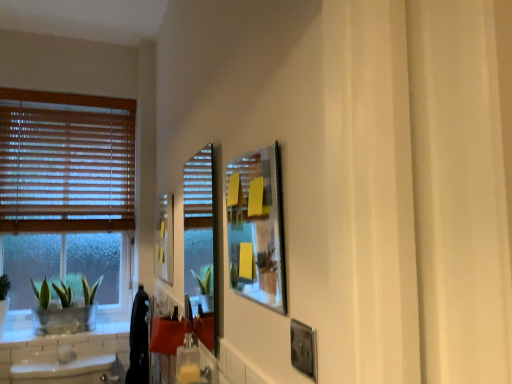
You are a GUI agent. You are given a task and a screenshot of the screen. Output one action in this format:
    pyautogui.click(x=<x>, y=<y>)
    Task: Click on the black fabric laundry at lower left
    
    Given the screenshot: What is the action you would take?
    pyautogui.click(x=138, y=341)

In order to face matte yellow picture frame at upper left, acting as the 1th picture frame starting from the back, should I rotate leftwards or rightwards?

A 12.450 degree turn to the left will do.

I want to click on black fabric laundry at lower left, so click(138, 341).

From the image's perspective, which object appears higher, wooden blinds at left or matte yellow picture frame at upper left, the 3th picture frame from the right?

wooden blinds at left, from the image's perspective.

Is the depth of wooden blinds at left less than that of matte yellow picture frame at upper left, arranged as the first picture frame when viewed from the left?

No, wooden blinds at left is further to the viewer.

Does point (93, 110) come farther from viewer compared to point (159, 201)?

Yes, point (93, 110) is farther from viewer.

Which of these two, wooden blinds at left or matte yellow picture frame at upper left, acting as the 1th picture frame starting from the back, stands taller?

wooden blinds at left is taller.

Considering the positions of objects metallic silver picture frame at upper center, acting as the second picture frame starting from the back, and black fabric laundry at lower left in the image provided, who is more to the left, metallic silver picture frame at upper center, acting as the second picture frame starting from the back, or black fabric laundry at lower left?

black fabric laundry at lower left.

Could you tell me if metallic silver picture frame at upper center, placed as the second picture frame when sorted from right to left, is facing black fabric laundry at lower left?

No, metallic silver picture frame at upper center, placed as the second picture frame when sorted from right to left, is not facing towards black fabric laundry at lower left.

Is black fabric laundry at lower left a part of metallic silver picture frame at upper center, the second picture frame when ordered from left to right?

No, black fabric laundry at lower left is not a part of metallic silver picture frame at upper center, the second picture frame when ordered from left to right.

How far apart are clear glass screen door at center and green leafy plant in clear glass pot at left?

clear glass screen door at center and green leafy plant in clear glass pot at left are 28.48 inches apart from each other.

Is clear glass screen door at center far away from green leafy plant in clear glass pot at left?

No, clear glass screen door at center is in close proximity to green leafy plant in clear glass pot at left.

Which object is positioned more to the left, clear glass screen door at center or green leafy plant in clear glass pot at left?

green leafy plant in clear glass pot at left is more to the left.

Based on the photo, is clear glass screen door at center next to wooden blinds at left and touching it?

No, clear glass screen door at center is not next to wooden blinds at left.

Can you confirm if clear glass screen door at center is smaller than wooden blinds at left?

Correct, clear glass screen door at center occupies less space than wooden blinds at left.

Is point (187, 187) positioned after point (131, 177)?

Yes.

How different are the orientations of clear glass screen door at center and wooden blinds at left in degrees?

clear glass screen door at center and wooden blinds at left are facing 90.7 degrees away from each other.

Based on the photo, is black fabric laundry at lower left thinner than metallic silver picture frame at lower right, which is the third picture frame from left to right?

No, black fabric laundry at lower left is not thinner than metallic silver picture frame at lower right, which is the third picture frame from left to right.

From the image's perspective, is black fabric laundry at lower left over metallic silver picture frame at lower right, the 3th picture frame viewed from the back?

No, from the image's perspective, black fabric laundry at lower left is not on top of metallic silver picture frame at lower right, the 3th picture frame viewed from the back.

Looking at this image, considering the relative positions of black fabric laundry at lower left and metallic silver picture frame at lower right, which is the third picture frame from left to right, in the image provided, is black fabric laundry at lower left to the left of metallic silver picture frame at lower right, which is the third picture frame from left to right, from the viewer's perspective?

Yes, black fabric laundry at lower left is to the left of metallic silver picture frame at lower right, which is the third picture frame from left to right.

Are black fabric laundry at lower left and matte yellow picture frame at upper left, acting as the 1th picture frame starting from the back, making contact?

No, black fabric laundry at lower left is not beside matte yellow picture frame at upper left, acting as the 1th picture frame starting from the back.

Looking at this image, from a real-world perspective, who is located lower, black fabric laundry at lower left or matte yellow picture frame at upper left, the 3th picture frame from the right?

black fabric laundry at lower left is physically lower.

Considering the relative positions of black fabric laundry at lower left and matte yellow picture frame at upper left, which is counted as the third picture frame, starting from the front, in the image provided, is black fabric laundry at lower left to the right of matte yellow picture frame at upper left, which is counted as the third picture frame, starting from the front, from the viewer's perspective?

No.

From the image's perspective, is matte yellow picture frame at upper left, arranged as the first picture frame when viewed from the left, located above or below black fabric laundry at lower left?

From the image's perspective, matte yellow picture frame at upper left, arranged as the first picture frame when viewed from the left, appears above black fabric laundry at lower left.

Is matte yellow picture frame at upper left, which is counted as the third picture frame, starting from the front, next to black fabric laundry at lower left and touching it?

No, matte yellow picture frame at upper left, which is counted as the third picture frame, starting from the front, is not touching black fabric laundry at lower left.

Which object is positioned more to the left, matte yellow picture frame at upper left, which is counted as the third picture frame, starting from the front, or black fabric laundry at lower left?

black fabric laundry at lower left is more to the left.

Considering the relative sizes of matte yellow picture frame at upper left, which is counted as the third picture frame, starting from the front, and black fabric laundry at lower left in the image provided, is matte yellow picture frame at upper left, which is counted as the third picture frame, starting from the front, bigger than black fabric laundry at lower left?

No, matte yellow picture frame at upper left, which is counted as the third picture frame, starting from the front, is not bigger than black fabric laundry at lower left.

The width and height of the screenshot is (512, 384). What are the coordinates of `the 2nd picture frame positioned below the wooden blinds at left (from a real-world perspective)` in the screenshot? It's located at (164, 239).

This screenshot has height=384, width=512. In order to click on laundry behind the metallic silver picture frame at upper center, placed as the second picture frame when sorted from right to left in this screenshot , I will do `click(138, 341)`.

Based on their spatial positions, is green leafy plant in clear glass pot at left or black fabric laundry at lower left closer to matte yellow picture frame at upper left, acting as the 1th picture frame starting from the back?

Based on the image, black fabric laundry at lower left appears to be nearer to matte yellow picture frame at upper left, acting as the 1th picture frame starting from the back.

Considering their positions, is matte yellow picture frame at upper left, acting as the 1th picture frame starting from the back, positioned closer to clear glass screen door at center than metallic silver picture frame at lower right, which is the third picture frame from left to right?

matte yellow picture frame at upper left, acting as the 1th picture frame starting from the back, is positioned closer to the anchor clear glass screen door at center.

Looking at the image, which one is located closer to matte yellow picture frame at upper left, which is counted as the third picture frame, starting from the front, wooden blinds at left or green leafy plant in clear glass pot at left?

The object closer to matte yellow picture frame at upper left, which is counted as the third picture frame, starting from the front, is green leafy plant in clear glass pot at left.

Considering their positions, is clear glass screen door at center positioned further to black fabric laundry at lower left than matte yellow picture frame at upper left, acting as the 1th picture frame starting from the back?

clear glass screen door at center lies further to black fabric laundry at lower left than the other object.

Looking at the image, which one is located further to clear glass screen door at center, black fabric laundry at lower left or wooden blinds at left?

wooden blinds at left lies further to clear glass screen door at center than the other object.

Estimate the real-world distances between objects in this image. Which object is further from green leafy plant in clear glass pot at left, metallic silver picture frame at lower right, which is the third picture frame from left to right, or wooden blinds at left?

The object further to green leafy plant in clear glass pot at left is metallic silver picture frame at lower right, which is the third picture frame from left to right.

Considering their positions, is black fabric laundry at lower left positioned further to metallic silver picture frame at lower right, which is the third picture frame from left to right, than wooden blinds at left?

wooden blinds at left is positioned further to the anchor metallic silver picture frame at lower right, which is the third picture frame from left to right.

Which object lies nearer to the anchor point matte yellow picture frame at upper left, the 3th picture frame from the right, clear glass screen door at center or black fabric laundry at lower left?

black fabric laundry at lower left lies closer to matte yellow picture frame at upper left, the 3th picture frame from the right, than the other object.

This screenshot has height=384, width=512. Identify the location of laundry between clear glass screen door at center and green leafy plant in clear glass pot at left along the z-axis. (138, 341).

The width and height of the screenshot is (512, 384). I want to click on laundry between metallic silver picture frame at upper center, which is the second picture frame in front-to-back order, and wooden blinds at left, along the z-axis, so click(x=138, y=341).

You are a GUI agent. You are given a task and a screenshot of the screen. Output one action in this format:
    pyautogui.click(x=<x>, y=<y>)
    Task: Click on the picture frame located between clear glass screen door at center and black fabric laundry at lower left in the depth direction
    The height and width of the screenshot is (384, 512).
    Given the screenshot: What is the action you would take?
    pyautogui.click(x=164, y=239)

I want to click on picture frame located between metallic silver picture frame at upper center, the second picture frame when ordered from left to right, and green leafy plant in clear glass pot at left in the depth direction, so click(x=164, y=239).